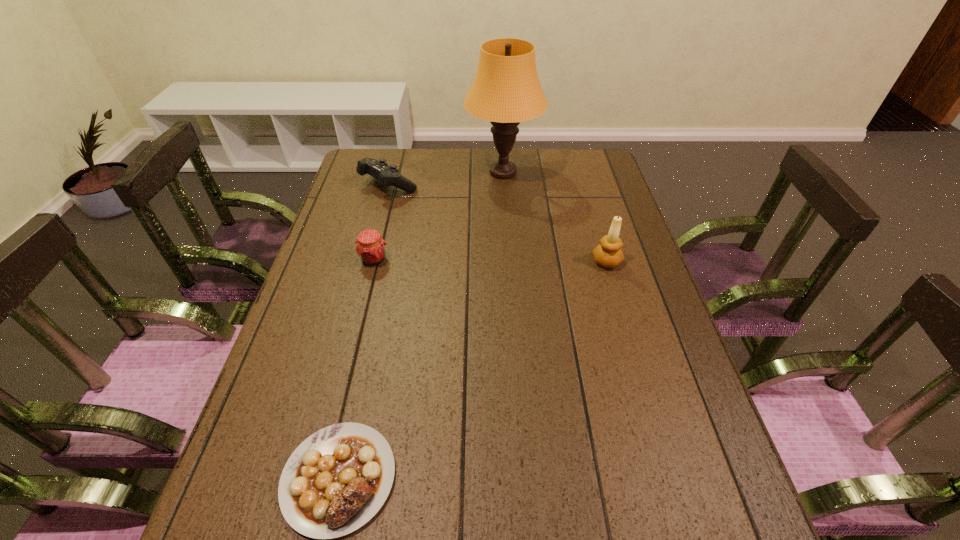
At what (x,y) coordinates should I click in order to perform the action: click on lampshade located in the far edge section of the desktop. Please return your answer as a coordinate pair (x, y). The image size is (960, 540). Looking at the image, I should click on (506, 90).

The width and height of the screenshot is (960, 540). In order to click on control positioned at the far edge in this screenshot , I will do `click(387, 176)`.

Find the location of a particular element. The image size is (960, 540). control situated at the left edge is located at coordinates (387, 176).

Image resolution: width=960 pixels, height=540 pixels. Find the location of `jam that is at the left edge`. jam that is at the left edge is located at coordinates (370, 247).

Find the location of a particular element. object situated at the right edge is located at coordinates (608, 254).

The image size is (960, 540). I want to click on object that is at the far left corner, so click(x=387, y=176).

Locate an element on the screen. The width and height of the screenshot is (960, 540). free region at the far edge is located at coordinates (439, 164).

The height and width of the screenshot is (540, 960). I want to click on vacant space at the near edge of the desktop, so click(501, 536).

What are the coordinates of `blank space at the left edge` in the screenshot? It's located at (302, 315).

This screenshot has width=960, height=540. Find the location of `free region at the right edge`. free region at the right edge is located at coordinates (574, 185).